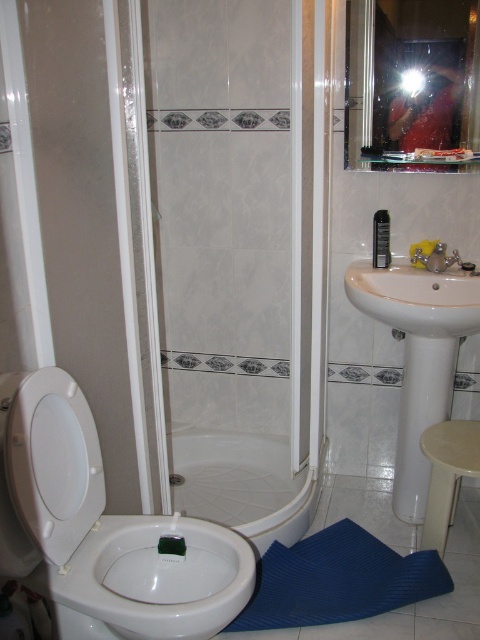
You are standing in the bathroom and want to clean both the white glossy toilet bowl at lower left and the white glossy bathtub at center. Which one should you clean first if you want to start with the one nearest to you?

You should clean the white glossy toilet bowl at lower left first because it is closer to the viewer than the white glossy bathtub at center.

You are a home inspector assessing the bathroom layout. You need to determine if the white glossy shower door at center can be removed and replaced with a larger one without affecting the white glossy bidet at lower left. Based on their sizes, what would you advise?

The white glossy shower door at center is currently larger than the white glossy bidet at lower left. If you replace it with an even larger one, it might encroach on the bidet space, but if the new door is the same size or smaller, it should be fine.

Based on the photo, please provide the coordinates of the white glossy shower door at center in the bathroom scene described.

The white glossy shower door at center is located at coordinates point (239,252).